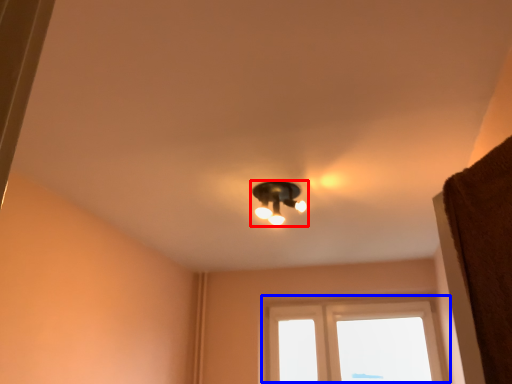
Question: Which point is closer to the camera, lamp (highlighted by a red box) or window (highlighted by a blue box)?

Choices:
 (A) lamp
 (B) window

Answer: (A)